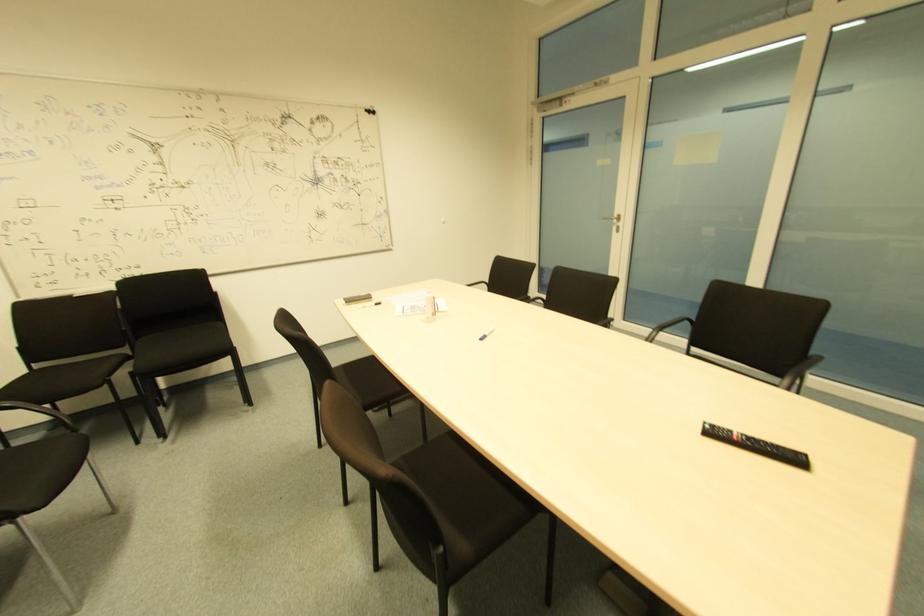
This screenshot has height=616, width=924. Describe the element at coordinates (358, 299) in the screenshot. I see `a whiteboard eraser` at that location.